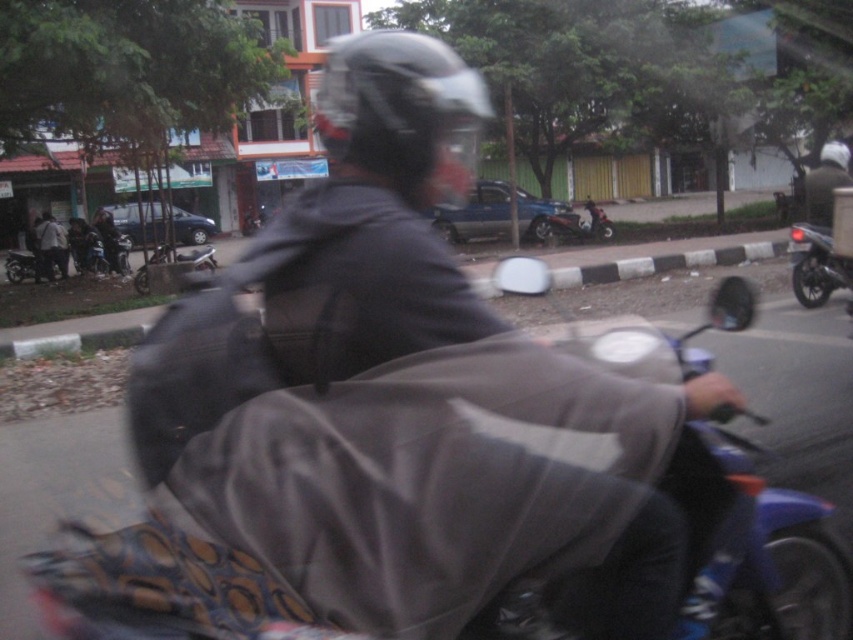
Question: Can you confirm if metallic silver scooter at center is positioned below metallic silver motorcycle at center?

Choices:
 (A) yes
 (B) no

Answer: (B)

Question: Which object is farther from the camera taking this photo?

Choices:
 (A) metallic silver scooter at center
 (B) metallic silver motorcycle at center

Answer: (A)

Question: Among these points, which one is farthest from the camera?

Choices:
 (A) (x=595, y=218)
 (B) (x=828, y=284)
 (C) (x=373, y=38)
 (D) (x=148, y=608)

Answer: (A)

Question: Where is metallic silver scooter at center located in relation to metallic silver motorcycle at center in the image?

Choices:
 (A) left
 (B) right

Answer: (B)

Question: Which of the following is the farthest from the observer?

Choices:
 (A) (375, 132)
 (B) (556, 234)
 (C) (154, 262)
 (D) (813, 577)

Answer: (B)

Question: Can you confirm if blue plastic motorcycle at center is wider than metallic silver scooter at center?

Choices:
 (A) yes
 (B) no

Answer: (A)